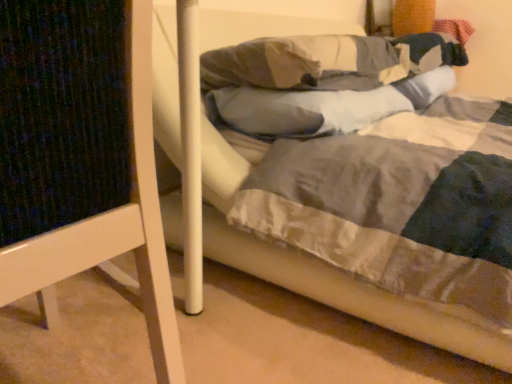
Measure the distance between white soft pillow at center, the 1th pillow viewed from the top, and camera.

white soft pillow at center, the 1th pillow viewed from the top, is 1.04 meters from camera.

Describe the element at coordinates (321, 106) in the screenshot. I see `gray soft pillow at center, which is the 1th pillow from bottom to top` at that location.

Locate an element on the screen. The image size is (512, 384). white soft pillow at center, arranged as the 2th pillow when ordered from the bottom is located at coordinates (305, 63).

The image size is (512, 384). Find the location of `pillow on the left of gray soft pillow at center, the second pillow from the top`. pillow on the left of gray soft pillow at center, the second pillow from the top is located at coordinates pyautogui.click(x=305, y=63).

Does gray soft pillow at center, which is the 1th pillow from bottom to top, contain white soft pillow at center, arranged as the 2th pillow when ordered from the bottom?

That's incorrect, white soft pillow at center, arranged as the 2th pillow when ordered from the bottom, is not inside gray soft pillow at center, which is the 1th pillow from bottom to top.

Considering the positions of objects gray soft pillow at center, which is the 1th pillow from bottom to top, and white soft pillow at center, the 1th pillow viewed from the top, in the image provided, who is more to the right, gray soft pillow at center, which is the 1th pillow from bottom to top, or white soft pillow at center, the 1th pillow viewed from the top,?

gray soft pillow at center, which is the 1th pillow from bottom to top.

Does gray soft pillow at center, the second pillow from the top, appear on the right side of white wood bed frame at left?

Indeed, gray soft pillow at center, the second pillow from the top, is positioned on the right side of white wood bed frame at left.

How many degrees apart are the facing directions of gray soft pillow at center, which is the 1th pillow from bottom to top, and white wood bed frame at left?

The facing directions of gray soft pillow at center, which is the 1th pillow from bottom to top, and white wood bed frame at left are 0.563 degrees apart.

Which of these two, gray soft pillow at center, which is the 1th pillow from bottom to top, or white wood bed frame at left, is smaller?

gray soft pillow at center, which is the 1th pillow from bottom to top, is smaller.

Considering the relative sizes of gray soft pillow at center, the second pillow from the top, and white wood bed frame at left in the image provided, is gray soft pillow at center, the second pillow from the top, taller than white wood bed frame at left?

In fact, gray soft pillow at center, the second pillow from the top, may be shorter than white wood bed frame at left.

Image resolution: width=512 pixels, height=384 pixels. In order to click on pillow located below the white soft pillow at center, the 1th pillow viewed from the top (from the image's perspective) in this screenshot , I will do `click(321, 106)`.

Is white soft pillow at center, arranged as the 2th pillow when ordered from the bottom, not close to gray soft pillow at center, which is the 1th pillow from bottom to top?

That's not correct — white soft pillow at center, arranged as the 2th pillow when ordered from the bottom, is a little close to gray soft pillow at center, which is the 1th pillow from bottom to top.

Considering the sizes of white soft pillow at center, the 1th pillow viewed from the top, and gray soft pillow at center, which is the 1th pillow from bottom to top, in the image, is white soft pillow at center, the 1th pillow viewed from the top, taller or shorter than gray soft pillow at center, which is the 1th pillow from bottom to top,?

white soft pillow at center, the 1th pillow viewed from the top, is taller than gray soft pillow at center, which is the 1th pillow from bottom to top.

Considering the sizes of objects white soft pillow at center, the 1th pillow viewed from the top, and gray soft pillow at center, the second pillow from the top, in the image provided, who is wider, white soft pillow at center, the 1th pillow viewed from the top, or gray soft pillow at center, the second pillow from the top,?

With larger width is white soft pillow at center, the 1th pillow viewed from the top.

Image resolution: width=512 pixels, height=384 pixels. In order to click on pillow that is the 2nd object located behind the white wood bed frame at left in this screenshot , I will do `click(321, 106)`.

Does white wood bed frame at left have a greater width compared to gray soft pillow at center, the second pillow from the top?

Correct, the width of white wood bed frame at left exceeds that of gray soft pillow at center, the second pillow from the top.

From a real-world perspective, relative to gray soft pillow at center, which is the 1th pillow from bottom to top, is white wood bed frame at left vertically above or below?

white wood bed frame at left is below gray soft pillow at center, which is the 1th pillow from bottom to top.

Can you confirm if white wood bed frame at left is positioned to the left of gray soft pillow at center, the second pillow from the top?

Indeed, white wood bed frame at left is positioned on the left side of gray soft pillow at center, the second pillow from the top.

Is white soft pillow at center, the 1th pillow viewed from the top, looking in the opposite direction of white wood bed frame at left?

That's not correct — white soft pillow at center, the 1th pillow viewed from the top, is not looking away from white wood bed frame at left.

In the scene shown: Can you tell me how much white soft pillow at center, the 1th pillow viewed from the top, and white wood bed frame at left differ in facing direction?

The angular difference between white soft pillow at center, the 1th pillow viewed from the top, and white wood bed frame at left is 0.632 degrees.

Between white soft pillow at center, arranged as the 2th pillow when ordered from the bottom, and white wood bed frame at left, which one has smaller size?

With smaller size is white soft pillow at center, arranged as the 2th pillow when ordered from the bottom.

Is white soft pillow at center, the 1th pillow viewed from the top, with white wood bed frame at left?

No, white soft pillow at center, the 1th pillow viewed from the top, is not next to white wood bed frame at left.

Considering the relative positions of white wood bed frame at left and white soft pillow at center, arranged as the 2th pillow when ordered from the bottom, in the image provided, is white wood bed frame at left to the left of white soft pillow at center, arranged as the 2th pillow when ordered from the bottom, from the viewer's perspective?

Indeed, white wood bed frame at left is positioned on the left side of white soft pillow at center, arranged as the 2th pillow when ordered from the bottom.

How different are the orientations of white wood bed frame at left and white soft pillow at center, the 1th pillow viewed from the top, in degrees?

They differ by 0.632 degrees in their facing directions.

Does white wood bed frame at left lie in front of white soft pillow at center, arranged as the 2th pillow when ordered from the bottom?

Yes.

Is white wood bed frame at left smaller than white soft pillow at center, arranged as the 2th pillow when ordered from the bottom?

No.

I want to click on pillow below the white soft pillow at center, arranged as the 2th pillow when ordered from the bottom (from a real-world perspective), so click(x=321, y=106).

At what (x,y) coordinates should I click in order to perform the action: click on furniture that appears in front of the gray soft pillow at center, which is the 1th pillow from bottom to top. Please return your answer as a coordinate pair (x, y). The width and height of the screenshot is (512, 384). Looking at the image, I should click on (81, 154).

Looking at this image, estimate the real-world distances between objects in this image. Which object is closer to white soft pillow at center, arranged as the 2th pillow when ordered from the bottom, gray soft pillow at center, which is the 1th pillow from bottom to top, or white wood bed frame at left?

The object closer to white soft pillow at center, arranged as the 2th pillow when ordered from the bottom, is gray soft pillow at center, which is the 1th pillow from bottom to top.

Which object lies further to the anchor point white wood bed frame at left, gray soft pillow at center, the second pillow from the top, or white soft pillow at center, the 1th pillow viewed from the top?

white soft pillow at center, the 1th pillow viewed from the top.

Consider the image. Looking at the image, which one is located closer to white wood bed frame at left, white soft pillow at center, the 1th pillow viewed from the top, or gray soft pillow at center, the second pillow from the top?

gray soft pillow at center, the second pillow from the top, is closer to white wood bed frame at left.

Which object lies nearer to the anchor point white soft pillow at center, the 1th pillow viewed from the top, white wood bed frame at left or gray soft pillow at center, which is the 1th pillow from bottom to top?

gray soft pillow at center, which is the 1th pillow from bottom to top.

Estimate the real-world distances between objects in this image. Which object is further from gray soft pillow at center, which is the 1th pillow from bottom to top, white soft pillow at center, arranged as the 2th pillow when ordered from the bottom, or white wood bed frame at left?

Among the two, white wood bed frame at left is located further to gray soft pillow at center, which is the 1th pillow from bottom to top.

Considering their positions, is white wood bed frame at left positioned further to gray soft pillow at center, the second pillow from the top, than white soft pillow at center, arranged as the 2th pillow when ordered from the bottom?

Based on the image, white wood bed frame at left appears to be further to gray soft pillow at center, the second pillow from the top.

Find the location of `pillow between white wood bed frame at left and gray soft pillow at center, the second pillow from the top, from front to back`. pillow between white wood bed frame at left and gray soft pillow at center, the second pillow from the top, from front to back is located at coordinates (305, 63).